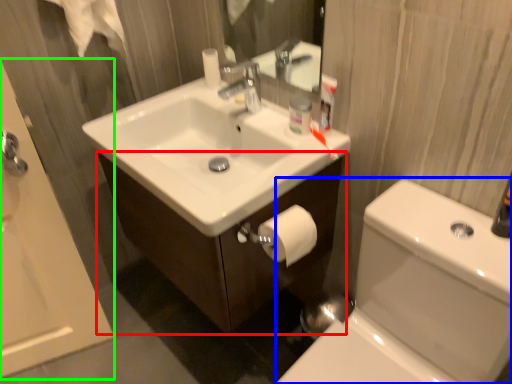
Question: Which object is the farthest from bathroom cabinet (highlighted by a red box)? Choose among these: toilet bowl (highlighted by a blue box) or bath (highlighted by a green box).

Choices:
 (A) toilet bowl
 (B) bath

Answer: (B)